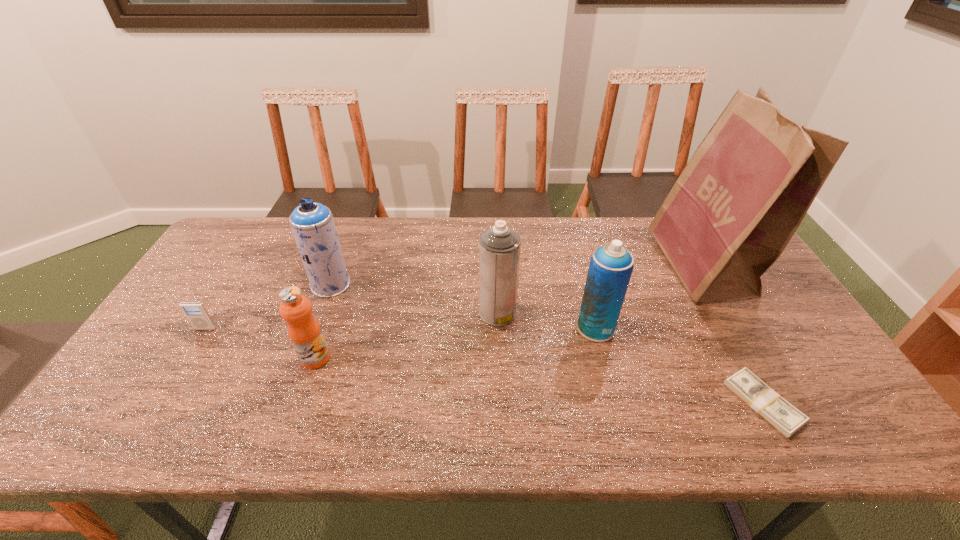
Locate an element on the screen. Image resolution: width=960 pixels, height=540 pixels. grocery bag is located at coordinates (746, 189).

Image resolution: width=960 pixels, height=540 pixels. In order to click on the fourth object from left to right in this screenshot , I will do `click(499, 246)`.

Find the location of a particular element. the farthest aerosol can is located at coordinates (313, 226).

Where is `the rightmost aerosol can`? the rightmost aerosol can is located at coordinates (610, 269).

Identify the location of the second nearest object. (304, 331).

The width and height of the screenshot is (960, 540). What are the coordinates of `fruit juice` in the screenshot? It's located at (304, 331).

Where is `iPod`? The width and height of the screenshot is (960, 540). iPod is located at coordinates (196, 313).

What are the coordinates of `the leftmost object` in the screenshot? It's located at (196, 313).

The height and width of the screenshot is (540, 960). What are the coordinates of `the nearest object` in the screenshot? It's located at (786, 418).

Identify the location of dollar. The image size is (960, 540). (786, 418).